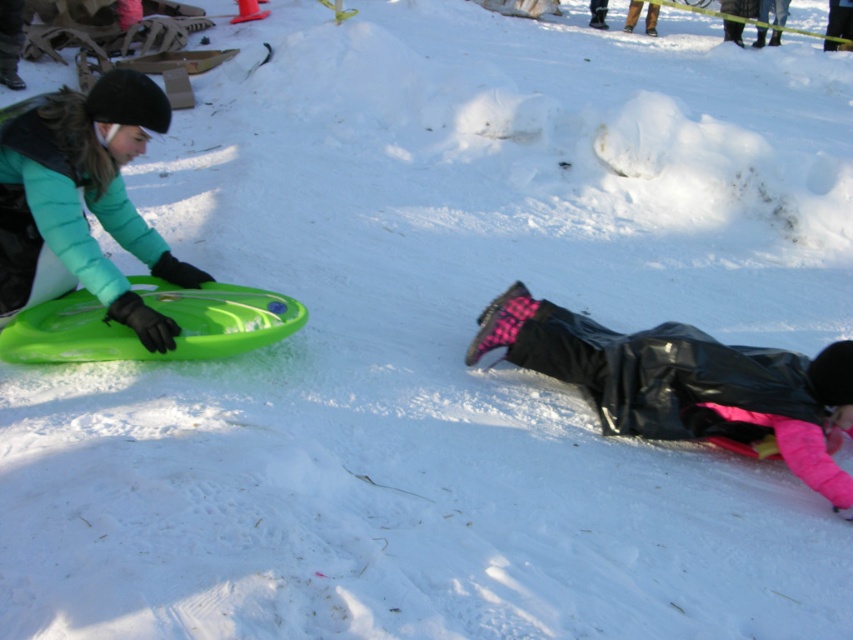
Measure the distance from black rubber pants at lower right to green matte sled at left.

black rubber pants at lower right is 6.40 feet from green matte sled at left.

Is black rubber pants at lower right below green matte sled at left?

Yes.

Is point (552, 344) closer to viewer compared to point (103, 124)?

That is False.

In order to click on black rubber pants at lower right in this screenshot , I will do `click(685, 381)`.